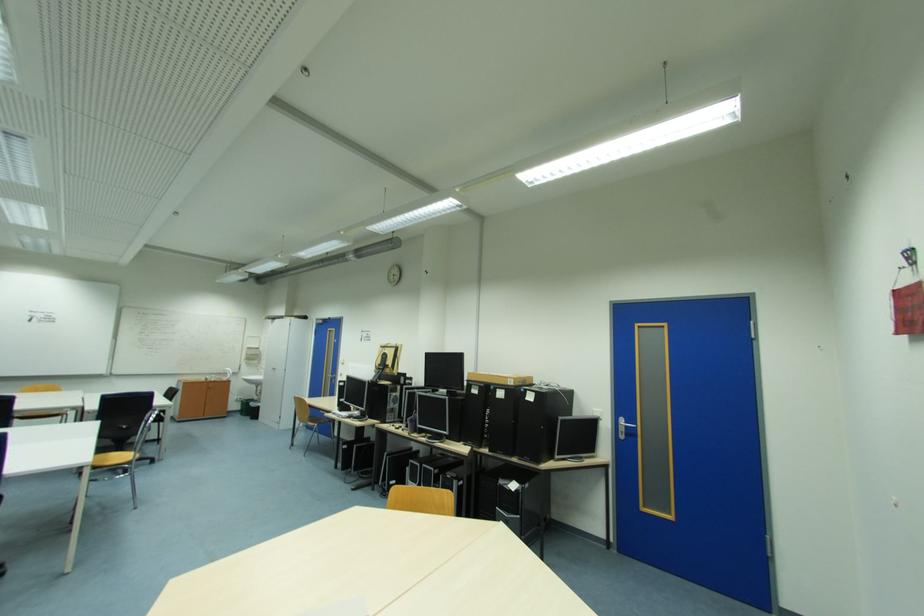
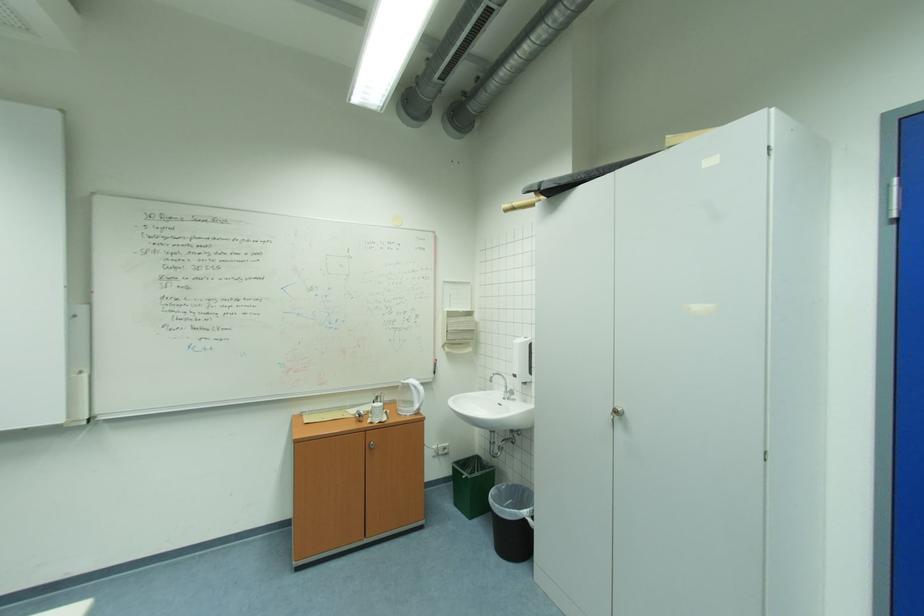
Locate, in the second image, the point that corresponds to (x=281, y=318) in the first image.

(569, 182)